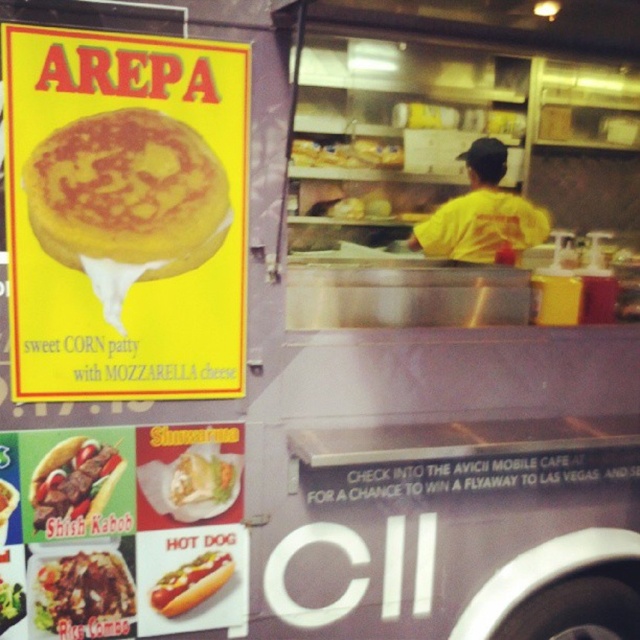
Question: Which object is positioned closest to the brown rice at center?

Choices:
 (A) yellow matte arepa at upper left
 (B) shiny yellow hot dog at center
 (C) shiny white tortilla at center
 (D) shiny white hot dog at lower center

Answer: (B)

Question: In this image, where is shiny yellow hot dog at center located relative to shiny white tortilla at center?

Choices:
 (A) left
 (B) right

Answer: (A)

Question: Can you confirm if shiny yellow hot dog at center is positioned to the left of shiny white tortilla at center?

Choices:
 (A) no
 (B) yes

Answer: (B)

Question: Among these points, which one is farthest from the camera?

Choices:
 (A) (209, 480)
 (B) (189, 595)
 (C) (92, 268)
 (D) (100, 634)

Answer: (B)

Question: Which point appears closest to the camera in this image?

Choices:
 (A) coord(170,484)
 (B) coord(67,588)
 (C) coord(6,86)

Answer: (C)

Question: Is brown rice at center smaller than shiny white tortilla at center?

Choices:
 (A) yes
 (B) no

Answer: (B)